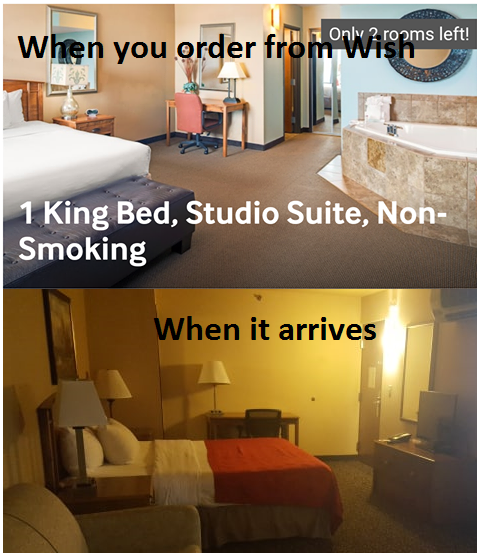
Where is `lamp`? The width and height of the screenshot is (477, 553). lamp is located at coordinates (88, 408), (118, 390), (211, 384).